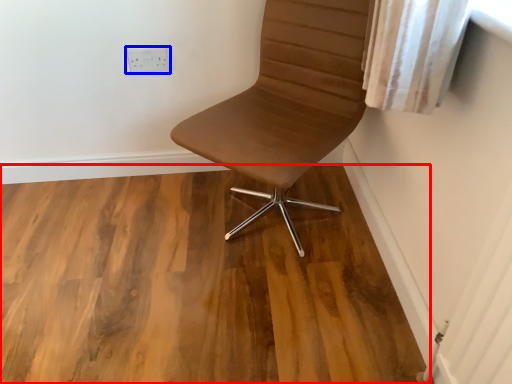
Question: Among these objects, which one is nearest to the camera, hardwood (highlighted by a red box) or electric outlet (highlighted by a blue box)?

Choices:
 (A) hardwood
 (B) electric outlet

Answer: (A)